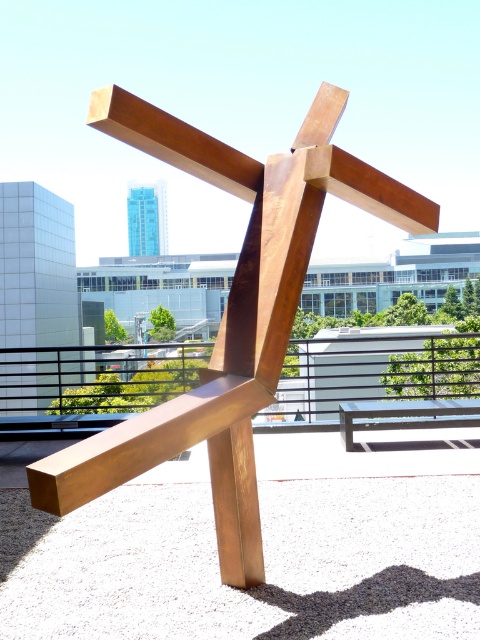
Question: Can you confirm if satin brown railing at center is smaller than wooden park bench at center?

Choices:
 (A) yes
 (B) no

Answer: (B)

Question: Which point is farther to the camera?

Choices:
 (A) (74, 456)
 (B) (346, 440)

Answer: (B)

Question: Is the position of bronze metallic sculpture at center less distant than that of wooden park bench at center?

Choices:
 (A) no
 (B) yes

Answer: (B)

Question: Which of the following is the farthest from the observer?

Choices:
 (A) (377, 417)
 (B) (252, 272)

Answer: (A)

Question: Can you confirm if satin brown railing at center is wider than wooden park bench at center?

Choices:
 (A) no
 (B) yes

Answer: (B)

Question: Which object is positioned farthest from the wooden park bench at center?

Choices:
 (A) satin brown railing at center
 (B) bronze metallic sculpture at center

Answer: (A)